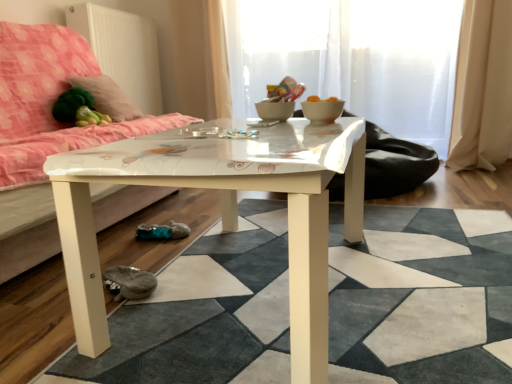
The height and width of the screenshot is (384, 512). I want to click on free spot above gray suede shoe at lower left (from a real-world perspective), so click(x=124, y=274).